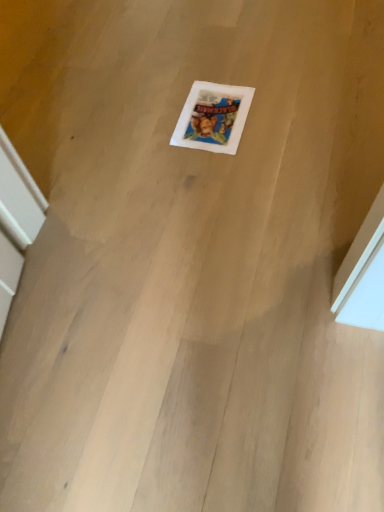
Locate an element on the screen. The image size is (384, 512). vacant space underneath white matte picture frame at center (from a real-world perspective) is located at coordinates (213, 114).